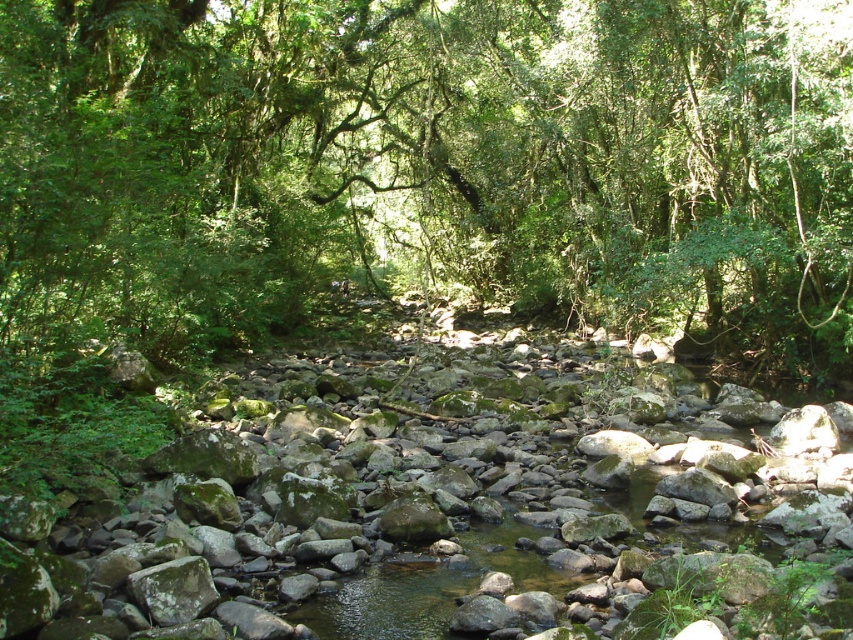
Question: Does green leafy tree at center lie in front of green mossy rock at center?

Choices:
 (A) yes
 (B) no

Answer: (B)

Question: Which object is farther from the camera taking this photo?

Choices:
 (A) green mossy rock at center
 (B) green leafy tree at center

Answer: (B)

Question: Where is green leafy tree at center located in relation to green mossy rock at center in the image?

Choices:
 (A) right
 (B) left

Answer: (B)

Question: Which point is closer to the camera taking this photo?

Choices:
 (A) (392, 118)
 (B) (608, 454)

Answer: (B)

Question: Can you confirm if green leafy tree at center is positioned above green mossy rock at center?

Choices:
 (A) no
 (B) yes

Answer: (B)